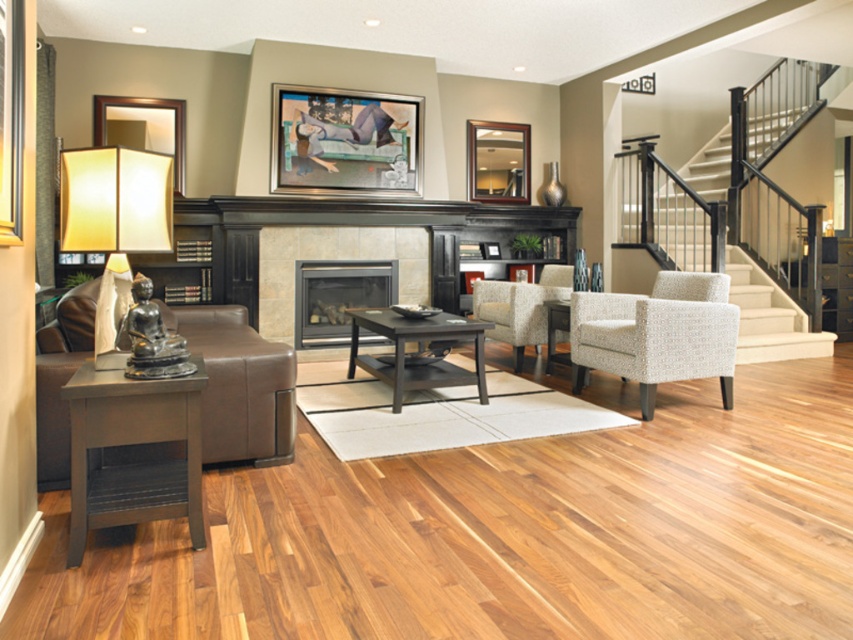
Question: Is matte gray end table at lower left wider than wooden mirror at upper center?

Choices:
 (A) yes
 (B) no

Answer: (B)

Question: Which point appears farthest from the camera in this image?

Choices:
 (A) (517, 160)
 (B) (115, 134)
 (C) (88, 458)

Answer: (A)

Question: Is matte gray end table at lower left to the right of matte yellow fabric lampshade at left from the viewer's perspective?

Choices:
 (A) no
 (B) yes

Answer: (B)

Question: Estimate the real-world distances between objects in this image. Which object is farther from the matte gray end table at lower left?

Choices:
 (A) metallic silver picture frame at upper center
 (B) beige fabric armchair at center

Answer: (A)

Question: Which point is farther to the camera?

Choices:
 (A) dark wood coffee table at center
 (B) matte gray end table at lower left
 (C) white textured stair at upper right

Answer: (C)

Question: Is neutral textured armchair at center below metallic silver picture frame at upper center?

Choices:
 (A) no
 (B) yes

Answer: (B)